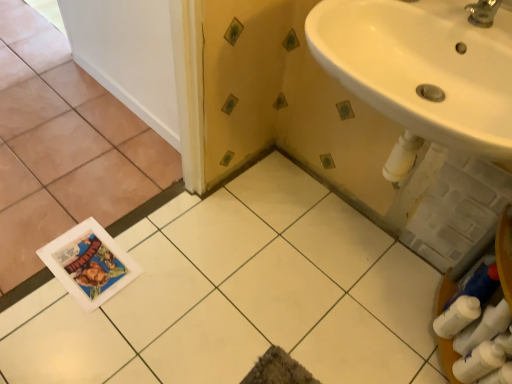
Question: Would you say white smooth door at upper left is outside white glossy tile at lower left, which is the second ceramic tile in right-to-left order?

Choices:
 (A) yes
 (B) no

Answer: (A)

Question: Is white smooth door at upper left placed right next to white glossy tile at lower left, which is the second ceramic tile in right-to-left order?

Choices:
 (A) yes
 (B) no

Answer: (B)

Question: Is white glossy tile at lower left, which appears as the 1th ceramic tile when viewed from the left, a part of white smooth door at upper left?

Choices:
 (A) no
 (B) yes

Answer: (A)

Question: Would you say white smooth door at upper left is a long distance from white glossy tile at lower left, which appears as the 1th ceramic tile when viewed from the left?

Choices:
 (A) yes
 (B) no

Answer: (B)

Question: Can you confirm if white smooth door at upper left is thinner than white glossy tile at lower left, which is the second ceramic tile in right-to-left order?

Choices:
 (A) no
 (B) yes

Answer: (B)

Question: Considering the positions of white glossy tile at center, arranged as the 2th ceramic tile when viewed from the left, and white smooth door at upper left in the image, is white glossy tile at center, arranged as the 2th ceramic tile when viewed from the left, bigger or smaller than white smooth door at upper left?

Choices:
 (A) small
 (B) big

Answer: (B)

Question: Considering the positions of white glossy tile at center, arranged as the 2th ceramic tile when viewed from the left, and white smooth door at upper left in the image, is white glossy tile at center, arranged as the 2th ceramic tile when viewed from the left, taller or shorter than white smooth door at upper left?

Choices:
 (A) tall
 (B) short

Answer: (B)

Question: In the image, is white glossy tile at center, marked as the 1th ceramic tile in a right-to-left arrangement, positioned in front of or behind white smooth door at upper left?

Choices:
 (A) behind
 (B) front

Answer: (B)

Question: Would you say white glossy tile at center, arranged as the 2th ceramic tile when viewed from the left, is to the left or to the right of white smooth door at upper left in the picture?

Choices:
 (A) right
 (B) left

Answer: (A)

Question: Is point (436, 117) positioned closer to the camera than point (456, 317)?

Choices:
 (A) farther
 (B) closer

Answer: (B)

Question: In terms of width, does white glossy sink at upper right look wider or thinner when compared to white matte toilet paper at lower right?

Choices:
 (A) wide
 (B) thin

Answer: (A)

Question: Based on their sizes in the image, would you say white glossy sink at upper right is bigger or smaller than white matte toilet paper at lower right?

Choices:
 (A) big
 (B) small

Answer: (A)

Question: Would you say white glossy sink at upper right is inside or outside white matte toilet paper at lower right?

Choices:
 (A) outside
 (B) inside

Answer: (A)

Question: Is white glossy tile at lower left, which is the second ceramic tile in right-to-left order, in front of or behind white glossy tile at center, marked as the 1th ceramic tile in a right-to-left arrangement, in the image?

Choices:
 (A) front
 (B) behind

Answer: (B)

Question: From the image's perspective, is white glossy tile at lower left, which is the second ceramic tile in right-to-left order, located above or below white glossy tile at center, marked as the 1th ceramic tile in a right-to-left arrangement?

Choices:
 (A) below
 (B) above

Answer: (B)